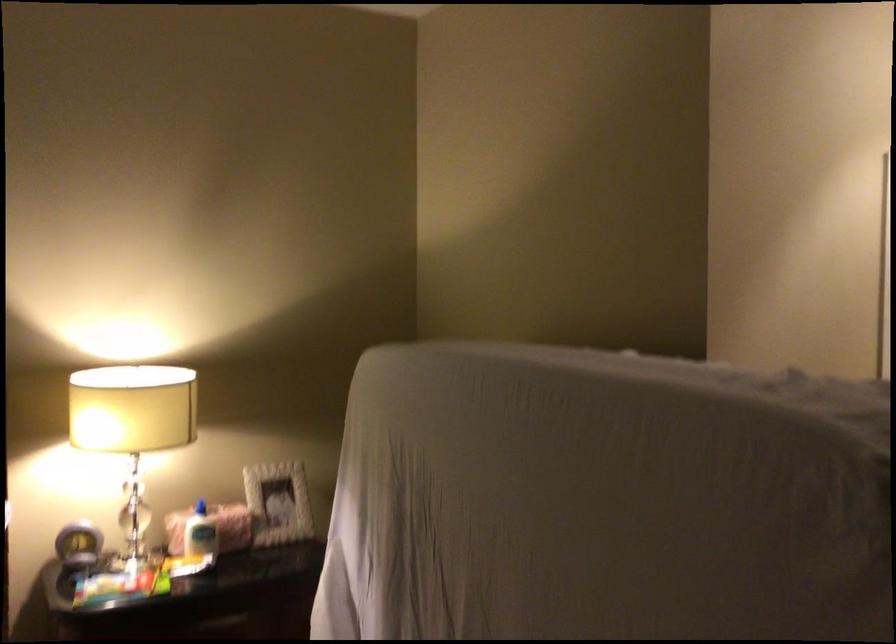
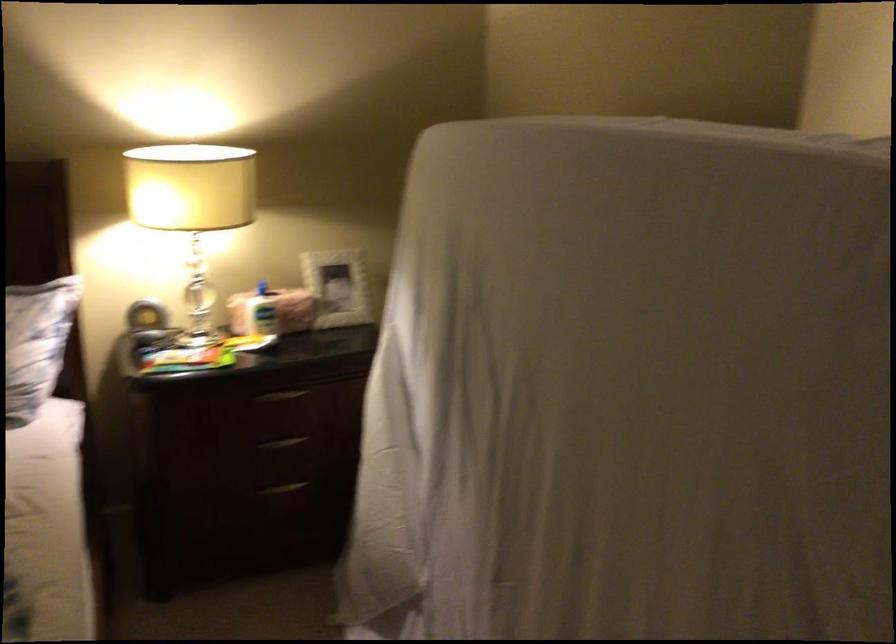
In the second image, find the point that corresponds to (76,542) in the first image.

(145, 316)